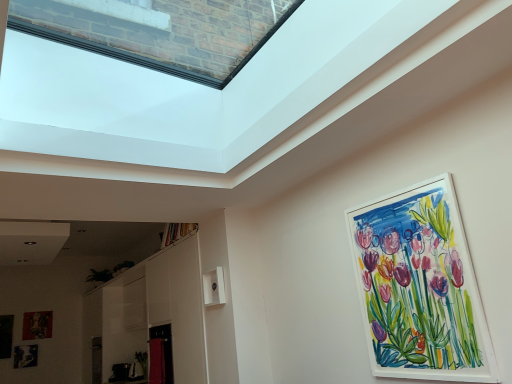
Question: From a real-world perspective, relative to watercolor paper painting at upper right, the 1th picture frame when ordered from right to left, is matte black picture frame at lower left, the third picture frame from the top, vertically above or below?

Choices:
 (A) above
 (B) below

Answer: (A)

Question: Is matte black picture frame at lower left, which is counted as the 4th picture frame, starting from the right, bigger or smaller than watercolor paper painting at upper right, the fourth picture frame from the back?

Choices:
 (A) small
 (B) big

Answer: (A)

Question: Considering the real-world distances, which object is closest to the matte black picture frame at lower left, the third picture frame from the top?

Choices:
 (A) metallic silver picture frame at lower left, which ranks as the 3th picture frame in front-to-back order
 (B) matte black picture frame at lower left, marked as the third picture frame in a left-to-right arrangement
 (C) watercolor paper painting at upper right, the fourth picture frame from the back

Answer: (A)

Question: Considering the real-world distances, which object is farthest from the matte black picture frame at lower left, marked as the third picture frame in a left-to-right arrangement?

Choices:
 (A) matte black picture frame at lower left, which is counted as the 4th picture frame, starting from the right
 (B) watercolor paper painting at upper right, placed as the 1th picture frame when sorted from front to back
 (C) metallic silver picture frame at lower left, which is the 1th picture frame from bottom to top

Answer: (B)